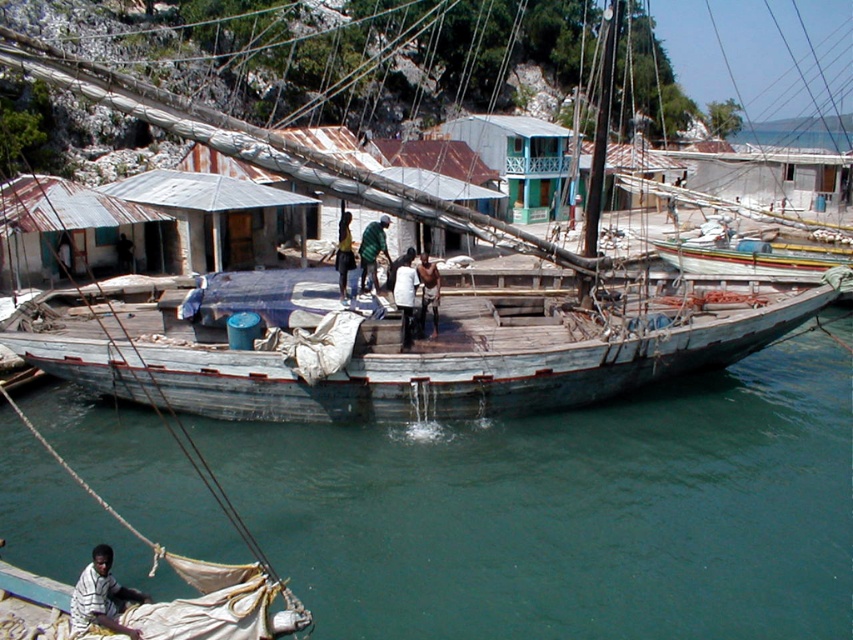
Locate an element on the screen. The image size is (853, 640). striped fabric shirt at lower left is located at coordinates (102, 596).

Can you confirm if striped fabric shirt at lower left is positioned above green fabric shirt at center?

No.

Does point (80, 611) come farther from viewer compared to point (374, 273)?

No, it is not.

The height and width of the screenshot is (640, 853). I want to click on striped fabric shirt at lower left, so click(102, 596).

Is point (350, 177) in front of point (410, 285)?

Yes, point (350, 177) is closer to viewer.

Does weathered wood boat at center have a lesser width compared to white matte shirt at center?

No.

Measure the distance between weathered wood boat at center and camera.

The distance of weathered wood boat at center from camera is 22.12 meters.

Where is `weathered wood boat at center`? The image size is (853, 640). weathered wood boat at center is located at coordinates (418, 368).

Does blue wooden boat at center have a greater width compared to green fabric shirt at center?

Yes, blue wooden boat at center is wider than green fabric shirt at center.

Between point (579, 588) and point (358, 253), which one is positioned behind?

Positioned behind is point (358, 253).

Is point (735, 406) farther from camera compared to point (358, 244)?

No, (735, 406) is closer to viewer.

Image resolution: width=853 pixels, height=640 pixels. Find the location of `blue wooden boat at center`. blue wooden boat at center is located at coordinates 570,513.